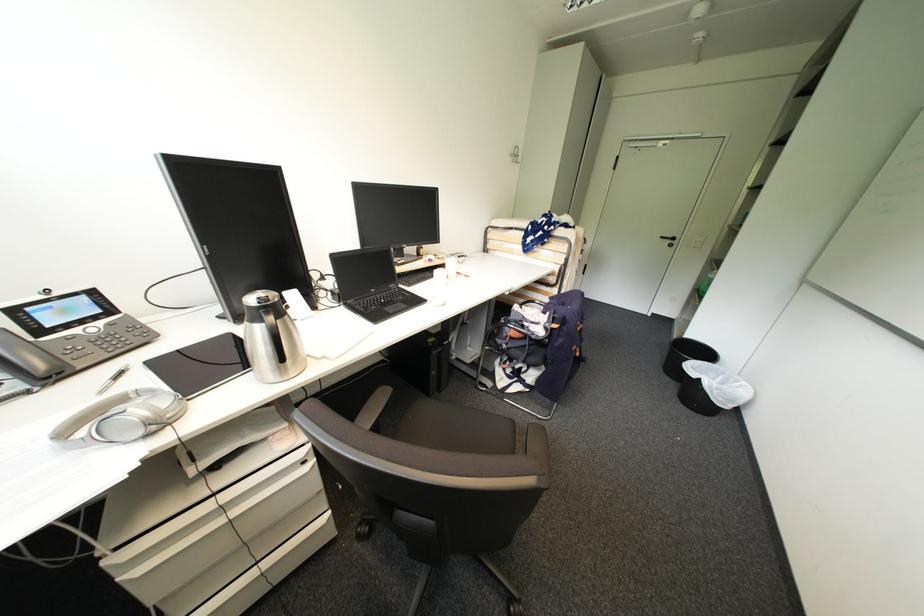
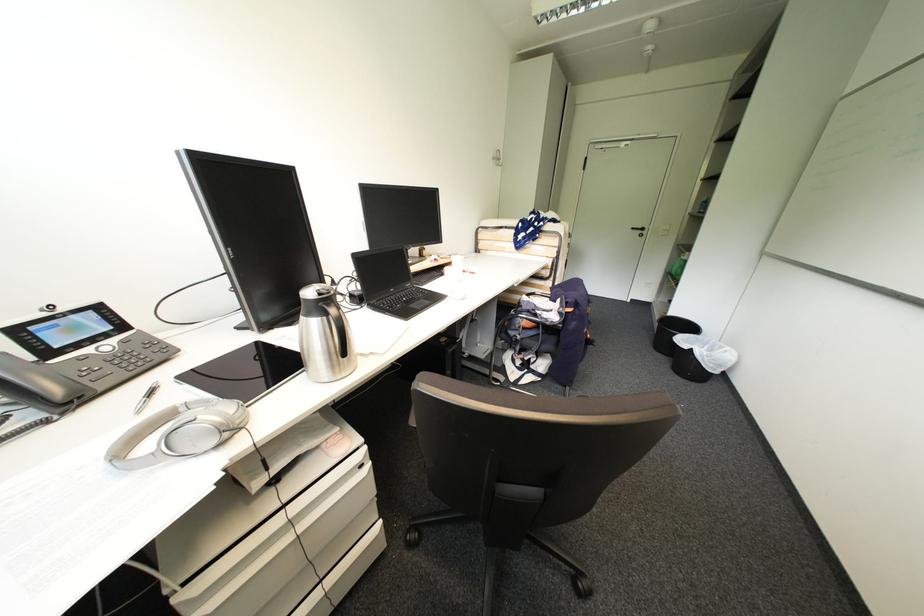
In the second image, find the point that corresponds to [670,373] in the first image.

(660, 351)